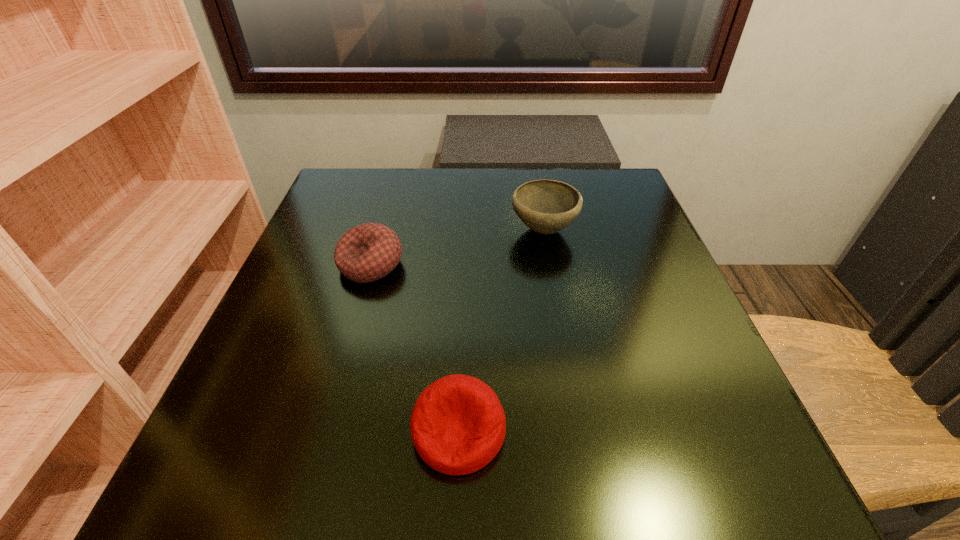
Find the location of `bowl`. bowl is located at coordinates (546, 206).

The height and width of the screenshot is (540, 960). Find the location of `the leftmost object`. the leftmost object is located at coordinates (368, 252).

Where is `the left beanbag`? The image size is (960, 540). the left beanbag is located at coordinates (368, 252).

Image resolution: width=960 pixels, height=540 pixels. Find the location of `the right beanbag`. the right beanbag is located at coordinates (458, 425).

Image resolution: width=960 pixels, height=540 pixels. I want to click on the nearer beanbag, so click(458, 425).

Where is `free space located 0.400m on the left of the bowl`? The width and height of the screenshot is (960, 540). free space located 0.400m on the left of the bowl is located at coordinates (333, 230).

Find the location of a particular element. The image size is (960, 540). vacant area situated 0.100m on the front of the farther beanbag is located at coordinates (353, 325).

You are a GUI agent. You are given a task and a screenshot of the screen. Output one action in this format:
    pyautogui.click(x=<x>, y=<y>)
    Task: Click on the object present at the far edge
    This screenshot has width=960, height=540.
    Given the screenshot: What is the action you would take?
    pyautogui.click(x=546, y=206)

What are the coordinates of `object at the near edge` in the screenshot? It's located at (458, 425).

In order to click on object that is at the left edge in this screenshot , I will do `click(368, 252)`.